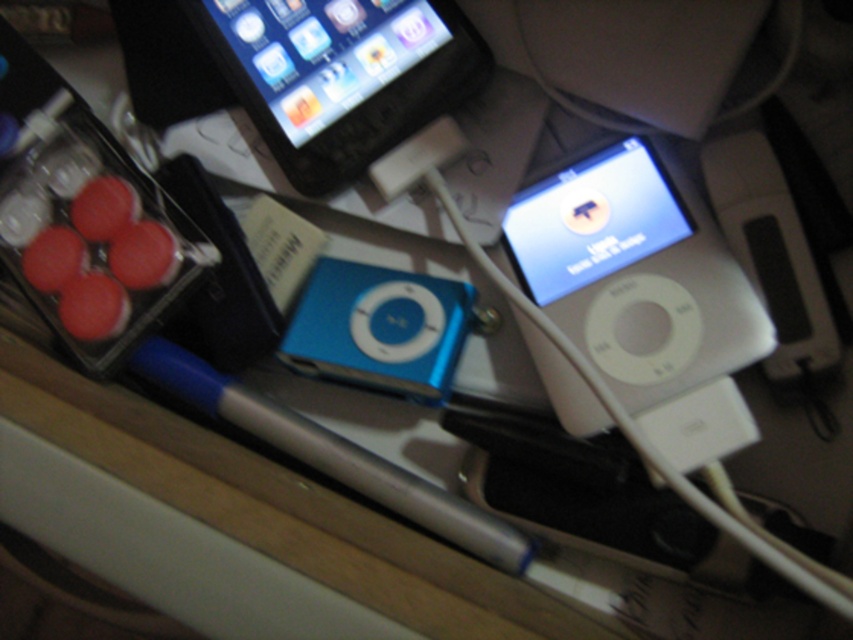
You have a small storage box that can only hold items smaller than the blue plastic ipod at center. Can the matte black phone at upper center fit into the storage box?

The matte black phone at upper center is bigger than the blue plastic ipod at center, so it cannot fit into the storage box designed for items smaller than the blue plastic ipod at center.

You have a protective case that fits items up to 10 cm in width. You need to place both the matte black phone at upper center and the blue plastic ipod at center into the case one at a time. Which device should you place first to ensure both can fit?

The blue plastic ipod at center has a smaller width than the matte black phone at upper center. Since the case can only fit items up to 10 cm, you should place the matte black phone at upper center first to ensure it fits, then the blue plastic ipod at center will also fit as it is narrower.